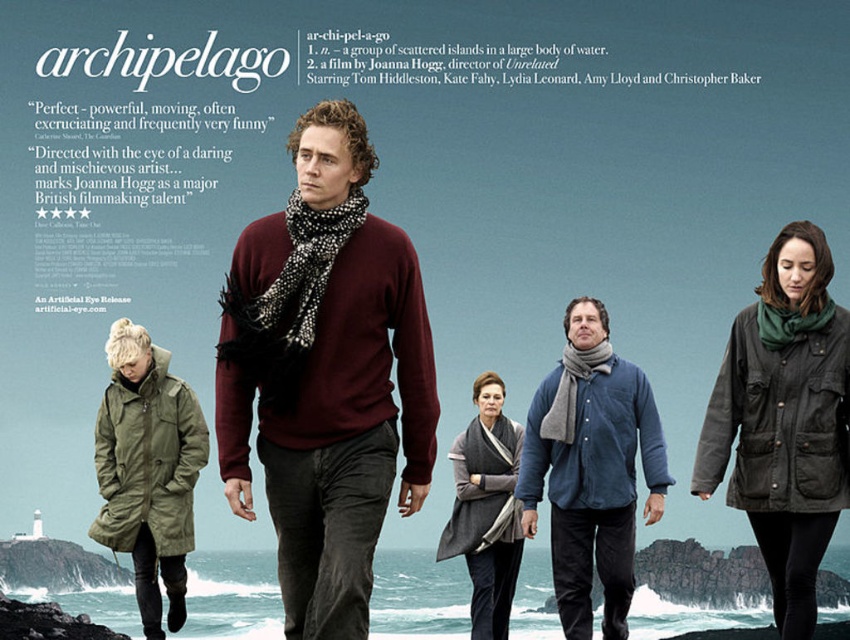
Does blue corduroy jacket at center have a greater height compared to gray wool scarf at center?

Yes.

Who is positioned more to the left, blue corduroy jacket at center or gray wool scarf at center?

Positioned to the left is gray wool scarf at center.

I want to click on blue corduroy jacket at center, so click(x=591, y=468).

Can you confirm if maroon sweater at center is positioned to the right of dark green waxed canvas jacket at lower right?

Incorrect, maroon sweater at center is not on the right side of dark green waxed canvas jacket at lower right.

Between maroon sweater at center and dark green waxed canvas jacket at lower right, which one appears on the left side from the viewer's perspective?

Positioned to the left is maroon sweater at center.

Which is behind, point (282, 321) or point (756, 544)?

Positioned behind is point (756, 544).

The width and height of the screenshot is (850, 640). Find the location of `maroon sweater at center`. maroon sweater at center is located at coordinates (326, 376).

Measure the distance from dark green waxed canvas jacket at lower right to olive-green parka at lower left.

dark green waxed canvas jacket at lower right is 89.22 feet away from olive-green parka at lower left.

Locate an element on the screen. This screenshot has height=640, width=850. dark green waxed canvas jacket at lower right is located at coordinates (785, 420).